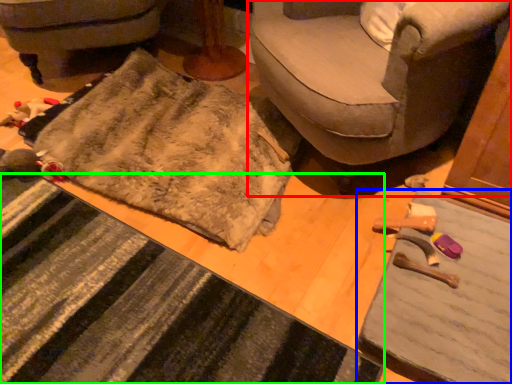
Question: Based on their relative distances, which object is farther from studio couch (highlighted by a red box)? Choose from table (highlighted by a blue box) and doormat (highlighted by a green box).

Choices:
 (A) table
 (B) doormat

Answer: (B)